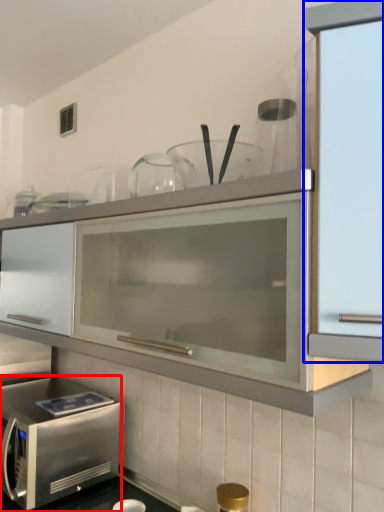
Question: Which object is closer to the camera taking this photo, microwave oven (highlighted by a red box) or cabinetry (highlighted by a blue box)?

Choices:
 (A) microwave oven
 (B) cabinetry

Answer: (B)